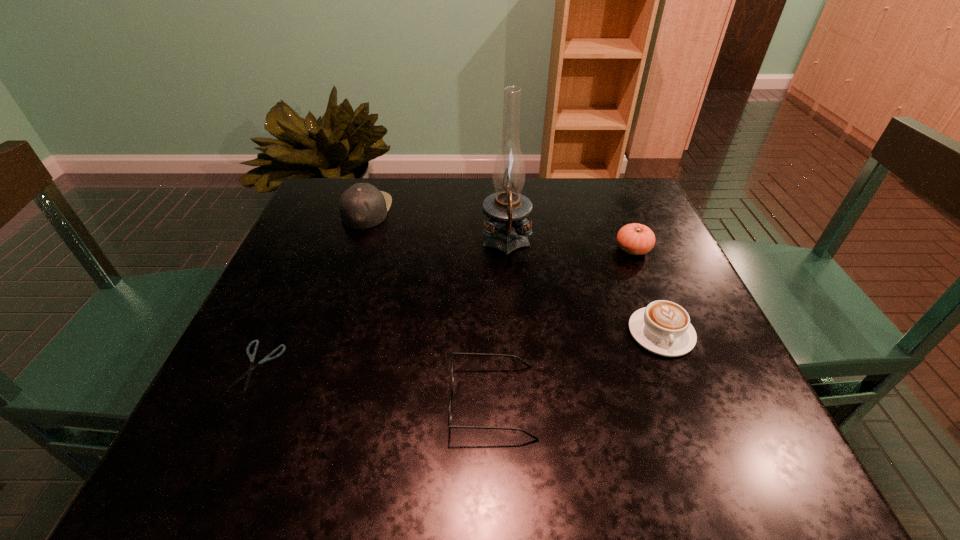
I want to click on the tallest object, so click(x=506, y=209).

At what (x,y) coordinates should I click in order to perform the action: click on the second object from left to right. Please return your answer as a coordinate pair (x, y). This screenshot has width=960, height=540. Looking at the image, I should click on (362, 206).

Image resolution: width=960 pixels, height=540 pixels. What are the coordinates of `the second tallest object` in the screenshot? It's located at (362, 206).

Find the location of a particular element. tomato is located at coordinates (636, 239).

I want to click on cappuccino, so click(663, 327).

The width and height of the screenshot is (960, 540). I want to click on spectacles, so click(453, 353).

Locate an element on the screen. The image size is (960, 540). the leftmost object is located at coordinates (249, 372).

Find the location of a particular element. the shortest object is located at coordinates (249, 372).

In order to click on vacant space located 0.200m on the front of the oil lamp in this screenshot , I will do `click(513, 333)`.

Identify the location of vacant space located on the brim of the fifth shortest object. The image size is (960, 540). (540, 210).